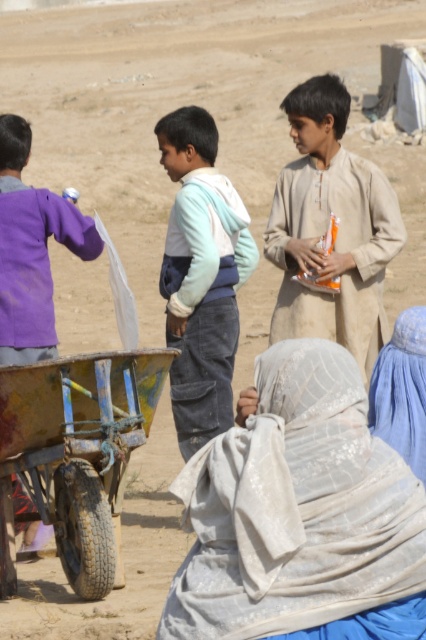
Can you confirm if light beige lace headscarf at center is smaller than beige cotton shirt at center?

Correct, light beige lace headscarf at center occupies less space than beige cotton shirt at center.

Is light beige lace headscarf at center positioned in front of beige cotton shirt at center?

Yes, light beige lace headscarf at center is closer to the viewer.

Find the location of a particular element. light beige lace headscarf at center is located at coordinates (296, 508).

Is point (325, 198) behind point (423, 397)?

Yes.

You are a GUI agent. You are given a task and a screenshot of the screen. Output one action in this format:
    pyautogui.click(x=<x>, y=<y>)
    Task: Click on the beige cotton shirt at center
    
    Given the screenshot: What is the action you would take?
    pyautogui.click(x=325, y=228)

Looking at this image, can you confirm if light blue denim pants at center is taller than purple cotton shirt at left?

Yes, light blue denim pants at center is taller than purple cotton shirt at left.

Does point (212, 292) come farther from viewer compared to point (34, 340)?

That is True.

This screenshot has height=640, width=426. I want to click on light blue denim pants at center, so click(201, 276).